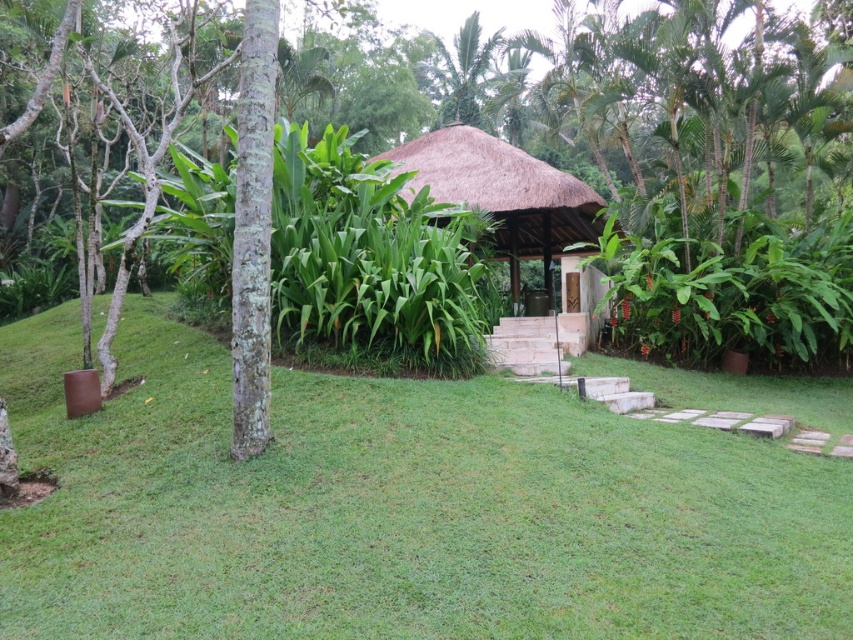
Question: Which of the following is the farthest from the observer?

Choices:
 (A) (514, 147)
 (B) (341, 388)
 (C) (782, 268)

Answer: (A)

Question: Which point is closer to the camera?

Choices:
 (A) brown textured tree at center
 (B) green grass at center
 (C) thatched straw gazebo at center

Answer: (B)

Question: Can you confirm if green grass at center is positioned above brown textured tree at center?

Choices:
 (A) no
 (B) yes

Answer: (A)

Question: Can you confirm if brown textured tree at center is positioned above thatched straw gazebo at center?

Choices:
 (A) no
 (B) yes

Answer: (B)

Question: Based on their relative distances, which object is nearer to the green grass at center?

Choices:
 (A) thatched straw gazebo at center
 (B) brown textured tree at center

Answer: (B)

Question: Can you confirm if green grass at center is smaller than thatched straw gazebo at center?

Choices:
 (A) yes
 (B) no

Answer: (B)